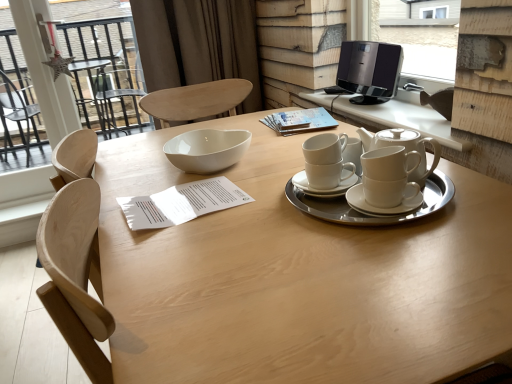
Question: Is black plastic speaker at upper right taller or shorter than transparent glass door at upper left?

Choices:
 (A) tall
 (B) short

Answer: (B)

Question: Looking at their shapes, would you say black plastic speaker at upper right is wider or thinner than transparent glass door at upper left?

Choices:
 (A) thin
 (B) wide

Answer: (B)

Question: Which of these objects is positioned closest to the black plastic speaker at upper right?

Choices:
 (A) transparent glass door at upper left
 (B) light wood table at center
 (C) white ceramic teapot at upper right
 (D) black glossy speaker at upper right
 (E) white paper at center

Answer: (D)

Question: Which object is the farthest from the white ceramic teapot at upper right?

Choices:
 (A) black glossy speaker at upper right
 (B) white ceramic teapot at upper right
 (C) white paper at center
 (D) transparent glass door at upper left
 (E) brown fabric curtain at upper center

Answer: (D)